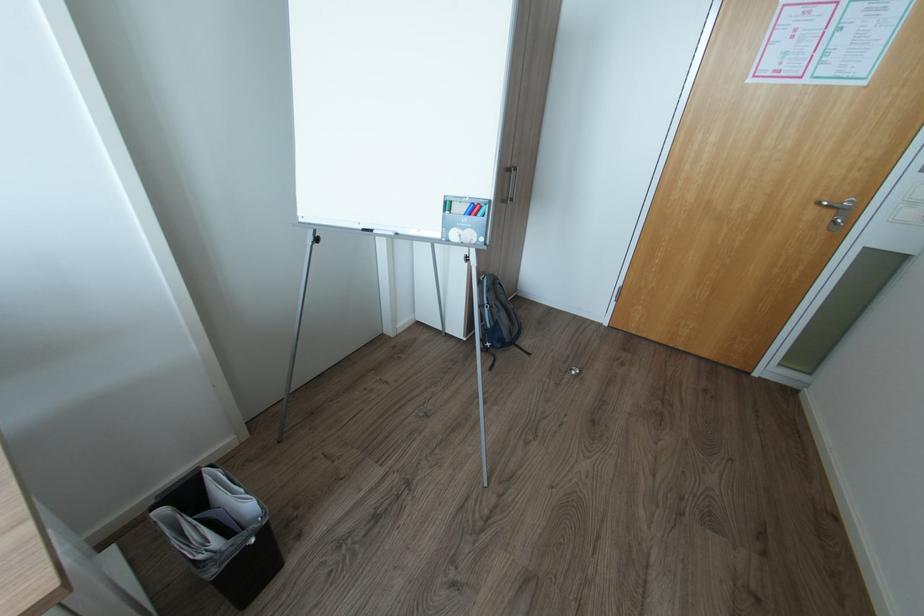
Where is `black whiteboard marker`? black whiteboard marker is located at coordinates (378, 231).